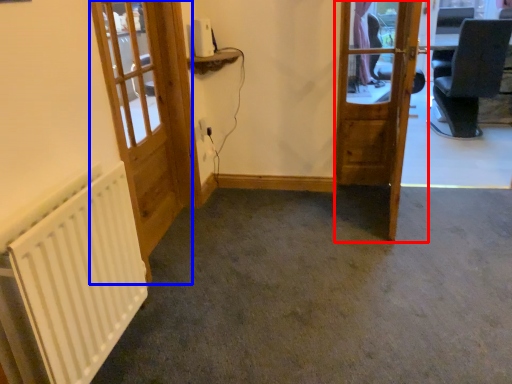
Question: Which point is closer to the camera, door (highlighted by a red box) or door (highlighted by a blue box)?

Choices:
 (A) door
 (B) door

Answer: (B)